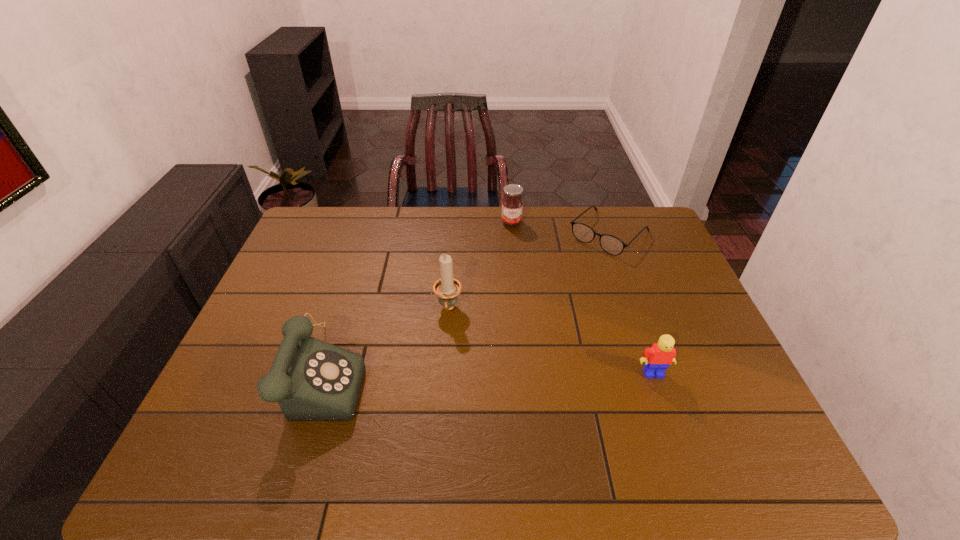
This screenshot has height=540, width=960. In order to click on free space at the far left corner of the desktop in this screenshot , I will do `click(335, 226)`.

I want to click on free region at the near left corner of the desktop, so click(x=234, y=401).

Locate an element on the screen. The image size is (960, 540). free space between the shortest object and the telephone is located at coordinates (465, 303).

Find the location of a particular element. The width and height of the screenshot is (960, 540). free spot between the second tallest object and the Lego is located at coordinates (487, 373).

Image resolution: width=960 pixels, height=540 pixels. What are the coordinates of `unoccupied area between the leftmost object and the candle_holder` in the screenshot? It's located at (384, 341).

The image size is (960, 540). Find the location of `vacant space in between the shortest object and the Lego`. vacant space in between the shortest object and the Lego is located at coordinates (631, 303).

I want to click on vacant space that's between the third nearest object and the second tallest object, so click(x=384, y=341).

What are the coordinates of `vacant region between the telephone and the third object from left to right` in the screenshot? It's located at (416, 298).

This screenshot has height=540, width=960. What are the coordinates of `free spot between the shortest object and the third object from left to right` in the screenshot? It's located at (561, 228).

Identify the location of vacant space that's between the jam and the shortest object. (561, 228).